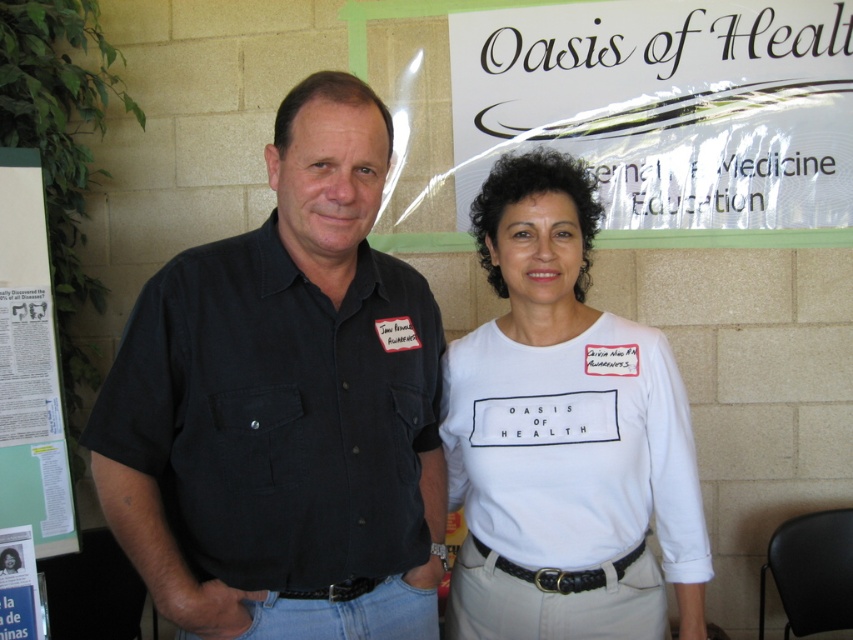
You are a visitor at the Oasis of Health event and see the white paper at left and the white paper poster at lower left. Which one is covering the other?

The white paper at left is positioned over the white paper poster at lower left, so it is covering the poster.

From the picture: What is the position of the black cotton shirt at center relative to the white paper at left in the image?

The black cotton shirt at center is to the right of the white paper at left.

You are a photographer setting up for a group photo. You need to ensure that the white cotton shirt at center and the white glossy signboard at upper center are both visible in the frame. Based on their positions, which one should you focus on first to ensure they are both in focus?

The white cotton shirt at center is below the white glossy signboard at upper center, so you should focus on the white glossy signboard at upper center first to ensure both are in focus.